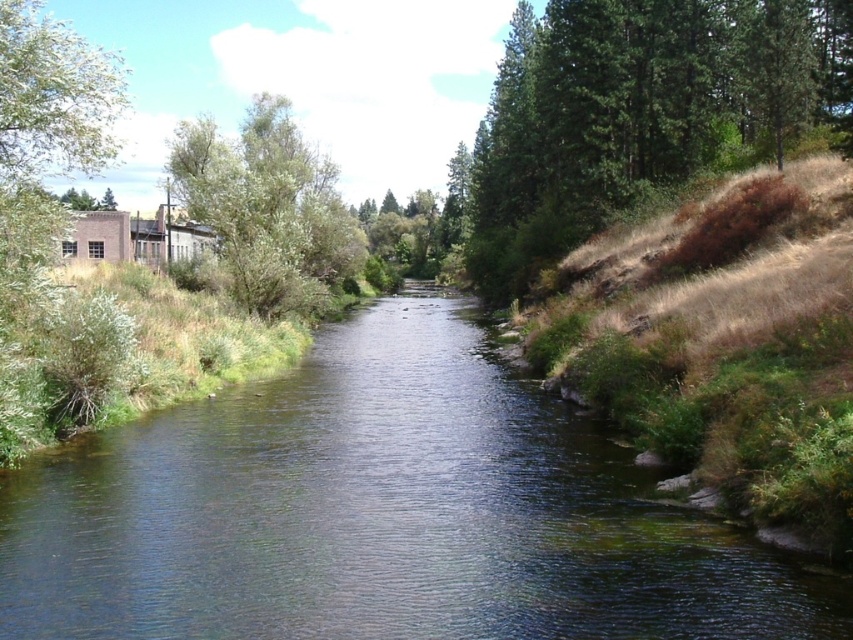
You are a bird flying over the river scene. You see the green textured tree at right and the green leafy tree at upper left. Which tree is positioned higher in the image?

The green textured tree at right is positioned higher than the green leafy tree at upper left in the image.

You are standing at the center of the river and want to reach the green leafy tree at left. Which direction should you head towards?

You should head towards the left direction to reach the green leafy tree at left since it is located at point (41, 177) which is on the left side of the river.

You are standing at the center of the river and looking towards the left bank. Which of the two green leafy trees, the green leafy tree at left or the green leafy tree at upper left, is positioned higher up in your field of view?

The green leafy tree at left is located above the green leafy tree at upper left, so when standing at the center of the river and looking towards the left bank, the green leafy tree at left is positioned higher up in your field of view.